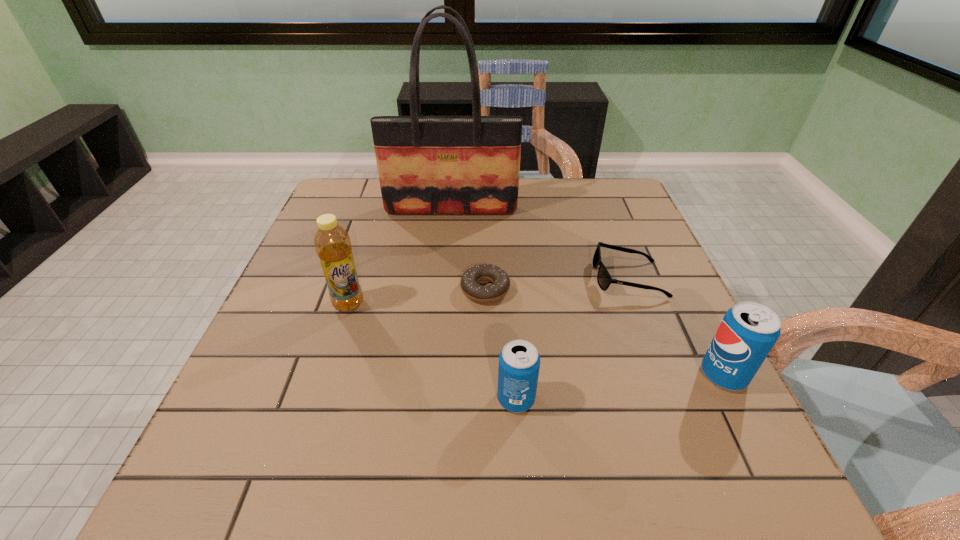
The image size is (960, 540). I want to click on free spot between the right soda can and the farthest object, so click(x=588, y=293).

Where is `vacant space that's between the shortest object and the shorter soda can`? vacant space that's between the shortest object and the shorter soda can is located at coordinates (500, 344).

Find the location of a particular element. free area in between the shorter soda can and the doughnut is located at coordinates (500, 344).

Where is `vacant area that lies between the shorter soda can and the doughnut`? Image resolution: width=960 pixels, height=540 pixels. vacant area that lies between the shorter soda can and the doughnut is located at coordinates point(500,344).

Identify the location of vacant region between the doughnut and the taller soda can. The width and height of the screenshot is (960, 540). (605, 332).

Locate an element on the screen. This screenshot has width=960, height=540. free space between the fifth tallest object and the shorter soda can is located at coordinates (572, 339).

I want to click on free space between the right soda can and the second tallest object, so pos(536,339).

At what (x,y) coordinates should I click in order to perform the action: click on free spot between the shorter soda can and the bottle. Please return your answer as a coordinate pair (x, y). This screenshot has width=960, height=540. Looking at the image, I should click on (432, 351).

Where is `free point between the fourth shortest object and the sunglasses`? This screenshot has height=540, width=960. free point between the fourth shortest object and the sunglasses is located at coordinates pyautogui.click(x=676, y=327).

Where is `object that is the closest to the second shortest object`? Image resolution: width=960 pixels, height=540 pixels. object that is the closest to the second shortest object is located at coordinates (748, 331).